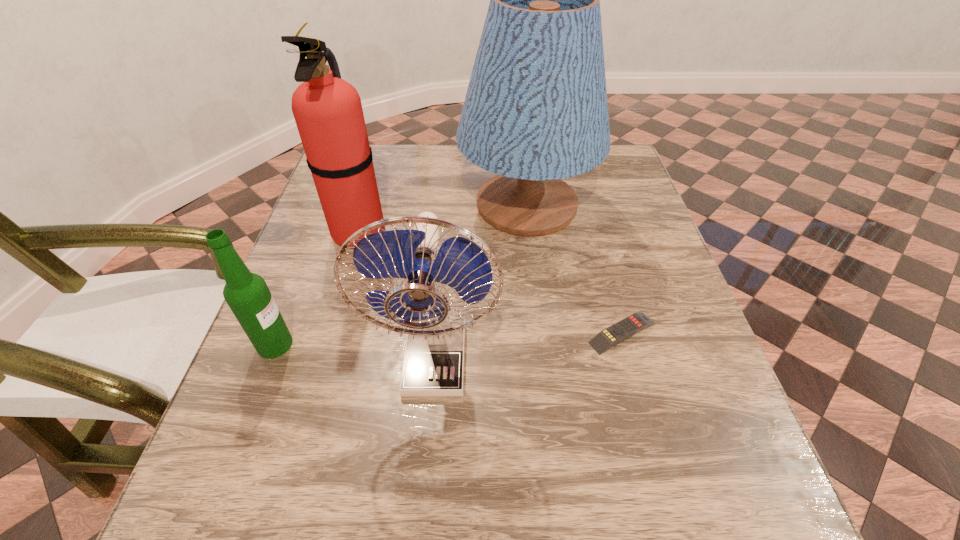
Locate an element on the screen. The width and height of the screenshot is (960, 540). lampshade is located at coordinates coord(535,112).

You are a GUI agent. You are given a task and a screenshot of the screen. Output one action in this format:
    pyautogui.click(x=<x>, y=<y>)
    Task: Click on the fire extinguisher
    The width and height of the screenshot is (960, 540).
    Given the screenshot: What is the action you would take?
    pyautogui.click(x=328, y=112)

Where is `fan`? The width and height of the screenshot is (960, 540). fan is located at coordinates (433, 366).

What are the coordinates of `the second shortest object` in the screenshot? It's located at (247, 294).

In order to click on the shortest object in this screenshot , I will do `click(618, 332)`.

Locate an element on the screen. free space located 0.090m on the back of the lampshade is located at coordinates (520, 152).

At what (x,y) coordinates should I click in order to perform the action: click on vacant point located at the nozzle of the fire extinguisher. Please return your answer as a coordinate pair (x, y). The image size is (960, 540). Looking at the image, I should click on click(446, 232).

At what (x,y) coordinates should I click in order to perform the action: click on vacant area situated 0.060m on the front-facing side of the fan. Please return your answer as a coordinate pair (x, y). The width and height of the screenshot is (960, 540). Looking at the image, I should click on (428, 442).

Identify the location of vacant region located 0.360m on the label of the beer bottle. The width and height of the screenshot is (960, 540). (488, 345).

Where is `vacant space located on the left of the shortest object`? This screenshot has height=540, width=960. vacant space located on the left of the shortest object is located at coordinates (432, 333).